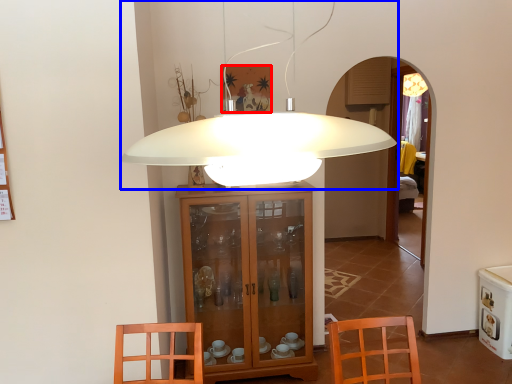
Question: Which object is closer to the camera taking this photo, picture frame (highlighted by a red box) or lamp (highlighted by a blue box)?

Choices:
 (A) picture frame
 (B) lamp

Answer: (B)